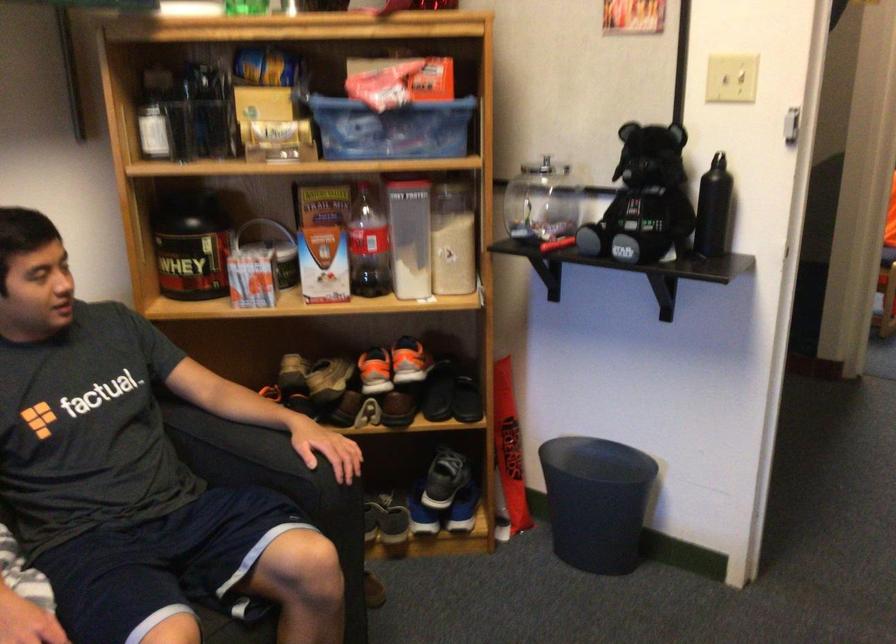
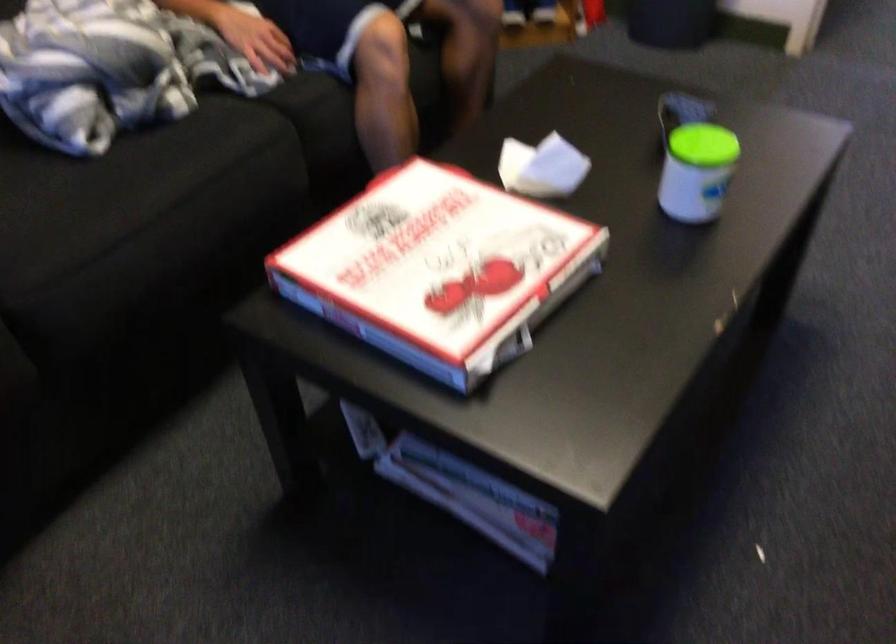
Which direction would the cameraman need to move to produce the second image?

The movement direction of the cameraman is left, backward.